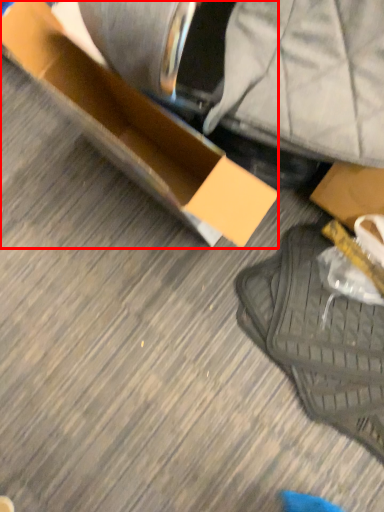
Question: Considering the relative positions of box (annotated by the red box) and footwear in the image provided, where is box (annotated by the red box) located with respect to the staircase?

Choices:
 (A) left
 (B) right

Answer: (A)